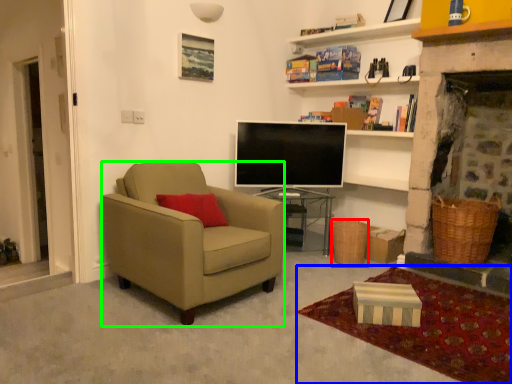
Question: Considering the real-world distances, which object is closest to picnic basket (highlighted by a red box)? plain (highlighted by a blue box) or chair (highlighted by a green box).

Choices:
 (A) plain
 (B) chair

Answer: (A)